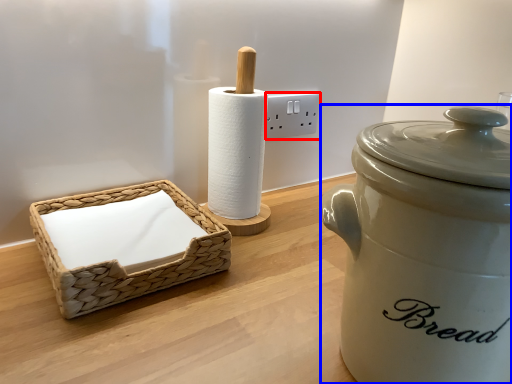
Question: Which point is further to the camera, electric outlet (highlighted by a red box) or rice cooker (highlighted by a blue box)?

Choices:
 (A) electric outlet
 (B) rice cooker

Answer: (A)